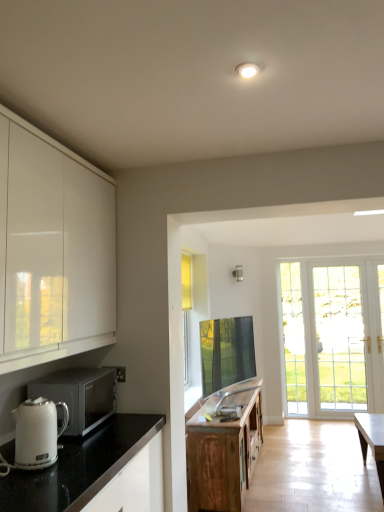
Question: Should I look upward or downward to see white glossy countertop at lower left?

Choices:
 (A) up
 (B) down

Answer: (B)

Question: Is white glossy electric kettle at lower left taller than wooden cabinet at center?

Choices:
 (A) no
 (B) yes

Answer: (A)

Question: Is wooden cabinet at center at the back of white glossy electric kettle at lower left?

Choices:
 (A) no
 (B) yes

Answer: (A)

Question: Is the depth of white glossy electric kettle at lower left greater than that of wooden cabinet at center?

Choices:
 (A) no
 (B) yes

Answer: (A)

Question: Can you confirm if white glossy electric kettle at lower left is wider than wooden cabinet at center?

Choices:
 (A) no
 (B) yes

Answer: (A)

Question: Is white glossy electric kettle at lower left positioned far away from wooden cabinet at center?

Choices:
 (A) no
 (B) yes

Answer: (B)

Question: From the image's perspective, would you say white glossy electric kettle at lower left is positioned over wooden cabinet at center?

Choices:
 (A) yes
 (B) no

Answer: (A)

Question: Considering the relative sizes of white glossy countertop at lower left and white glossy electric kettle at lower left in the image provided, is white glossy countertop at lower left thinner than white glossy electric kettle at lower left?

Choices:
 (A) no
 (B) yes

Answer: (A)

Question: From the image's perspective, would you say white glossy countertop at lower left is shown under white glossy electric kettle at lower left?

Choices:
 (A) no
 (B) yes

Answer: (B)

Question: Is white glossy countertop at lower left smaller than white glossy electric kettle at lower left?

Choices:
 (A) yes
 (B) no

Answer: (B)

Question: Is white glossy countertop at lower left located outside white glossy electric kettle at lower left?

Choices:
 (A) yes
 (B) no

Answer: (A)

Question: Is white glossy countertop at lower left not close to white glossy electric kettle at lower left?

Choices:
 (A) no
 (B) yes

Answer: (A)

Question: Is white glossy countertop at lower left further to camera compared to white glossy electric kettle at lower left?

Choices:
 (A) no
 (B) yes

Answer: (A)

Question: From the image's perspective, is white glossy electric kettle at lower left beneath silver metallic microwave at left?

Choices:
 (A) no
 (B) yes

Answer: (A)